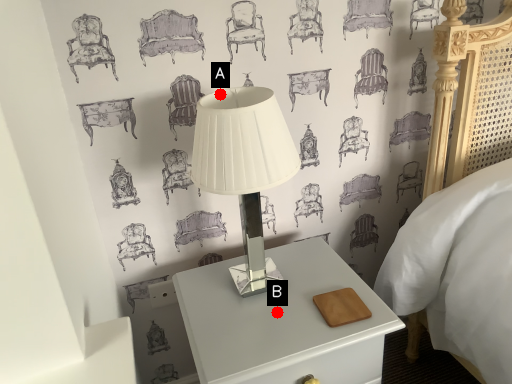
Question: Two points are circled on the image, labeled by A and B beside each circle. Which point is farther to the camera?

Choices:
 (A) A is further
 (B) B is further

Answer: (B)